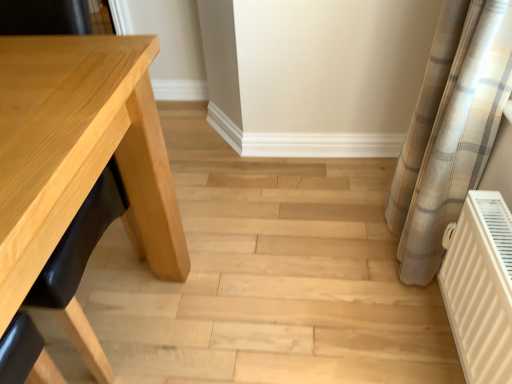
Where is `plaid fabric curtain at right`? Image resolution: width=512 pixels, height=384 pixels. plaid fabric curtain at right is located at coordinates (450, 130).

Find the location of a particular element. The height and width of the screenshot is (384, 512). white matte radiator at lower right is located at coordinates (480, 287).

Considering the relative sizes of light wood table at left and natural wood table at left in the image provided, is light wood table at left taller than natural wood table at left?

Indeed, light wood table at left has a greater height compared to natural wood table at left.

Where is `stair below the light wood table at left (from the image's perspective)`? stair below the light wood table at left (from the image's perspective) is located at coordinates (269, 278).

Who is bigger, light wood table at left or natural wood table at left?

light wood table at left is bigger.

From the image's perspective, is light wood table at left below natural wood table at left?

Incorrect, from the image's perspective, light wood table at left is higher than natural wood table at left.

Which is correct: white matte radiator at lower right is inside natural wood table at left, or outside of it?

white matte radiator at lower right is outside natural wood table at left.

From a real-world perspective, is white matte radiator at lower right physically located above or below natural wood table at left?

white matte radiator at lower right is situated higher than natural wood table at left in the real world.

Which of these two, white matte radiator at lower right or natural wood table at left, is thinner?

white matte radiator at lower right.

Which of these two, white matte radiator at lower right or natural wood table at left, is bigger?

natural wood table at left.

Between light wood table at left and plaid fabric curtain at right, which one has more height?

light wood table at left.

From the image's perspective, is light wood table at left positioned above or below plaid fabric curtain at right?

Based on their image positions, light wood table at left is located beneath plaid fabric curtain at right.

Which of these two, light wood table at left or plaid fabric curtain at right, is smaller?

plaid fabric curtain at right is smaller.

How much distance is there between white matte radiator at lower right and plaid fabric curtain at right?

white matte radiator at lower right is 10.23 inches from plaid fabric curtain at right.

Based on the photo, which of these two, white matte radiator at lower right or plaid fabric curtain at right, stands taller?

Standing taller between the two is plaid fabric curtain at right.

Would you say white matte radiator at lower right is a long distance from plaid fabric curtain at right?

Actually, white matte radiator at lower right and plaid fabric curtain at right are a little close together.

Does white matte radiator at lower right have a lesser width compared to light wood table at left?

Indeed, white matte radiator at lower right has a lesser width compared to light wood table at left.

Does white matte radiator at lower right have a lesser height compared to light wood table at left?

Yes.

Is white matte radiator at lower right inside or outside of light wood table at left?

white matte radiator at lower right is located beyond the bounds of light wood table at left.

Locate an element on the screen. curtain that appears above the natural wood table at left (from the image's perspective) is located at coordinates (450, 130).

Considering the sizes of objects natural wood table at left and plaid fabric curtain at right in the image provided, who is smaller, natural wood table at left or plaid fabric curtain at right?

plaid fabric curtain at right is smaller.

In the image, is natural wood table at left positioned in front of or behind plaid fabric curtain at right?

natural wood table at left is behind plaid fabric curtain at right.

Is natural wood table at left at the right side of plaid fabric curtain at right?

In fact, natural wood table at left is to the left of plaid fabric curtain at right.

Is the position of plaid fabric curtain at right less distant than that of light wood table at left?

No, plaid fabric curtain at right is further to the viewer.

In terms of width, does plaid fabric curtain at right look wider or thinner when compared to light wood table at left?

In the image, plaid fabric curtain at right appears to be more narrow than light wood table at left.

Is plaid fabric curtain at right smaller than light wood table at left?

Correct, plaid fabric curtain at right occupies less space than light wood table at left.

In the scene shown: From a real-world perspective, is plaid fabric curtain at right located higher than light wood table at left?

Incorrect, from a real-world perspective, plaid fabric curtain at right is lower than light wood table at left.

The width and height of the screenshot is (512, 384). What are the coordinates of `stair on the right of light wood table at left` in the screenshot? It's located at (269, 278).

At what (x,y) coordinates should I click in order to perform the action: click on radiator in front of the natural wood table at left. Please return your answer as a coordinate pair (x, y). Image resolution: width=512 pixels, height=384 pixels. Looking at the image, I should click on (x=480, y=287).

When comparing their distances from plaid fabric curtain at right, does white matte radiator at lower right or light wood table at left seem further?

The object further to plaid fabric curtain at right is light wood table at left.

Based on their spatial positions, is plaid fabric curtain at right or light wood table at left further from white matte radiator at lower right?

light wood table at left.

Which object lies nearer to the anchor point light wood table at left, natural wood table at left or white matte radiator at lower right?

Among the two, natural wood table at left is located nearer to light wood table at left.

Which object lies nearer to the anchor point light wood table at left, white matte radiator at lower right or natural wood table at left?

natural wood table at left.

Based on their spatial positions, is light wood table at left or natural wood table at left further from plaid fabric curtain at right?

The object further to plaid fabric curtain at right is light wood table at left.

Considering their positions, is natural wood table at left positioned further to plaid fabric curtain at right than light wood table at left?

Based on the image, light wood table at left appears to be further to plaid fabric curtain at right.

When comparing their distances from white matte radiator at lower right, does plaid fabric curtain at right or natural wood table at left seem further?

The object further to white matte radiator at lower right is natural wood table at left.

From the image, which object appears to be farther from white matte radiator at lower right, light wood table at left or natural wood table at left?

Based on the image, light wood table at left appears to be further to white matte radiator at lower right.

I want to click on radiator between light wood table at left and plaid fabric curtain at right in the horizontal direction, so click(480, 287).

This screenshot has height=384, width=512. I want to click on stair situated between light wood table at left and plaid fabric curtain at right from left to right, so click(x=269, y=278).

Where is `radiator between natural wood table at left and plaid fabric curtain at right`? This screenshot has height=384, width=512. radiator between natural wood table at left and plaid fabric curtain at right is located at coordinates (480, 287).

The height and width of the screenshot is (384, 512). Find the location of `stair located between light wood table at left and white matte radiator at lower right in the left-right direction`. stair located between light wood table at left and white matte radiator at lower right in the left-right direction is located at coordinates (269, 278).